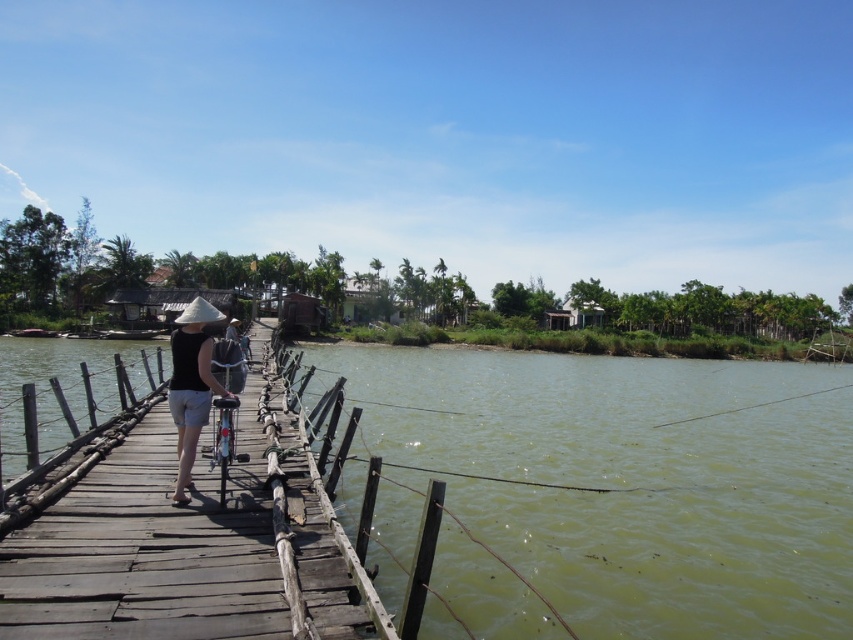
Question: Among these points, which one is nearest to the camera?

Choices:
 (A) (177, 429)
 (B) (227, 436)
 (C) (653, 444)
 (D) (178, 609)

Answer: (D)

Question: Observing the image, what is the correct spatial positioning of green murky water at center in reference to matte black shirt at center?

Choices:
 (A) above
 (B) below

Answer: (B)

Question: Where is wooden dock at center located in relation to metallic silver bicycle at center in the image?

Choices:
 (A) left
 (B) right

Answer: (A)

Question: Among these objects, which one is farthest from the camera?

Choices:
 (A) matte black shirt at center
 (B) green murky water at center
 (C) metallic silver bicycle at center
 (D) wooden dock at center

Answer: (A)

Question: Considering the relative positions of green murky water at center and wooden dock at center in the image provided, where is green murky water at center located with respect to wooden dock at center?

Choices:
 (A) right
 (B) left

Answer: (A)

Question: Which object appears farthest from the camera in this image?

Choices:
 (A) wooden dock at center
 (B) metallic silver bicycle at center
 (C) green murky water at center

Answer: (B)